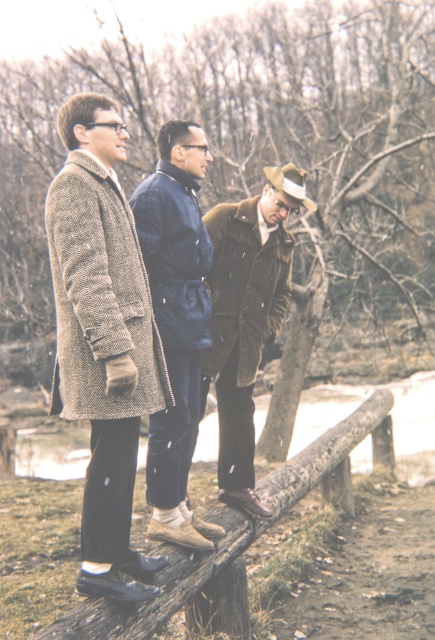
Who is positioned more to the right, blue down jacket at center or brown wooden rail at center?

brown wooden rail at center

Find the location of a particular element. This screenshot has width=435, height=640. blue down jacket at center is located at coordinates (176, 323).

Which is behind, point (186, 170) or point (261, 477)?

The point (261, 477) is behind.

Locate an element on the screen. The height and width of the screenshot is (640, 435). blue down jacket at center is located at coordinates (176, 323).

Can you confirm if brown tweed coat at left is wider than brown wooden rail at center?

Indeed, brown tweed coat at left has a greater width compared to brown wooden rail at center.

This screenshot has width=435, height=640. Describe the element at coordinates (103, 339) in the screenshot. I see `brown tweed coat at left` at that location.

I want to click on brown tweed coat at left, so click(103, 339).

Can you confirm if brown fuzzy coat at center is wider than brown wooden rail at center?

Correct, the width of brown fuzzy coat at center exceeds that of brown wooden rail at center.

Can you confirm if brown fuzzy coat at center is shorter than brown wooden rail at center?

No, brown fuzzy coat at center is not shorter than brown wooden rail at center.

Who is more forward, (231, 225) or (380, 392)?

Point (231, 225) is more forward.

Find the location of a particular element. Image resolution: width=435 pixels, height=640 pixels. brown fuzzy coat at center is located at coordinates (247, 316).